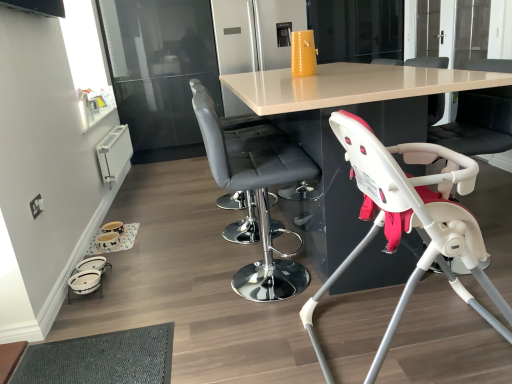
I want to click on free spot to the left of white plastic highchair at lower right, acting as the 2th chair starting from the right, so click(x=250, y=342).